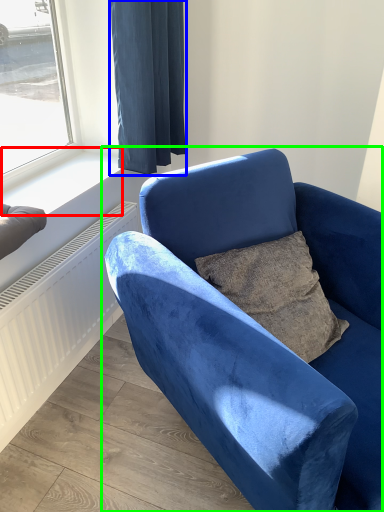
Question: Considering the real-world distances, which object is closest to window sill (highlighted by a red box)? curtain (highlighted by a blue box) or chair (highlighted by a green box).

Choices:
 (A) curtain
 (B) chair

Answer: (A)